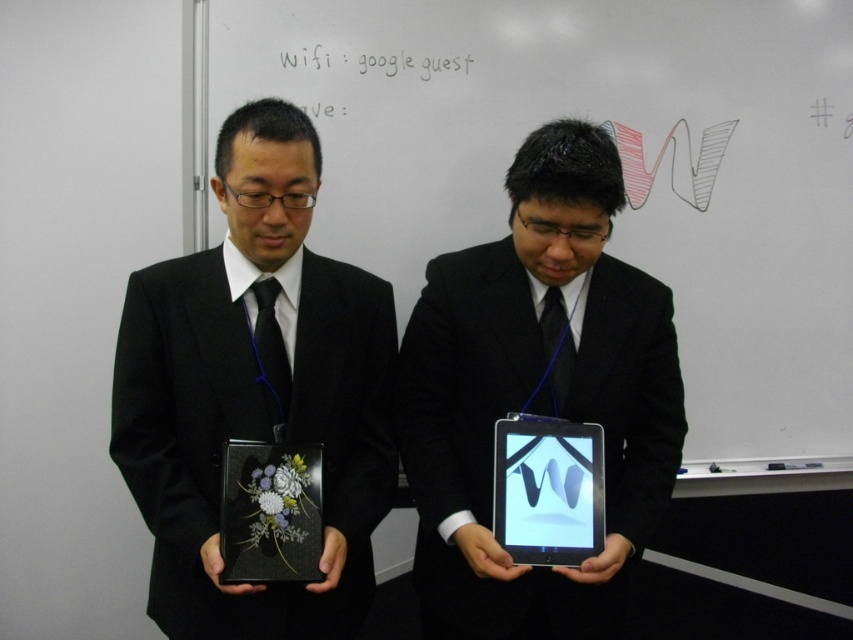
You are organizing a conference and need to place the matte black box at center and the shiny black tablet at center on a table. If the tablet is already placed, where should you position the box relative to the tablet?

The matte black box at center should be positioned to the left of the shiny black tablet at center since it is located to the left of the tablet in the image.

You are standing in front of the whiteboard and need to place a new sticker exactly at the coordinates given for the matte black box at center. What are the coordinates where you should place the sticker?

The coordinates for the matte black box at center are at point [256,390], so you should place the sticker at those coordinates.

You are an event organizer who needs to place a 3D printed model that is 2 inches thick on a table between the matte black box at center and the shiny black tablet at center. Based on their thickness, will the model fit between them?

The matte black box at center is thinner than the shiny black tablet at center. Since the 3D printed model is 2 inches thick, it depends on the combined thickness of both objects. However, the description only states the relative thickness between them, not their exact measurements. Therefore, it is impossible to determine if the model will fit without additional information about their actual thickness.